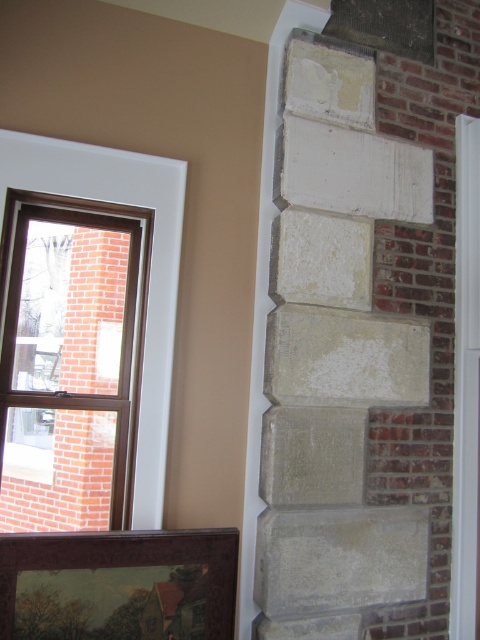
Question: Does clear glass window at upper left have a greater width compared to brown wooden picture frame at lower left?

Choices:
 (A) no
 (B) yes

Answer: (A)

Question: Which object is farther from the camera taking this photo?

Choices:
 (A) clear glass window at upper left
 (B) brown wooden picture frame at lower left
 (C) white stone carving at center

Answer: (C)

Question: Among these objects, which one is farthest from the camera?

Choices:
 (A) brown wooden picture frame at lower left
 (B) white stone carving at center
 (C) clear glass window at upper left

Answer: (B)

Question: Among these objects, which one is nearest to the camera?

Choices:
 (A) brown wooden picture frame at lower left
 (B) clear glass window at upper left

Answer: (A)

Question: Can you confirm if white stone carving at center is positioned to the left of clear glass window at upper left?

Choices:
 (A) no
 (B) yes

Answer: (A)

Question: Is white stone carving at center smaller than brown wooden picture frame at lower left?

Choices:
 (A) no
 (B) yes

Answer: (A)